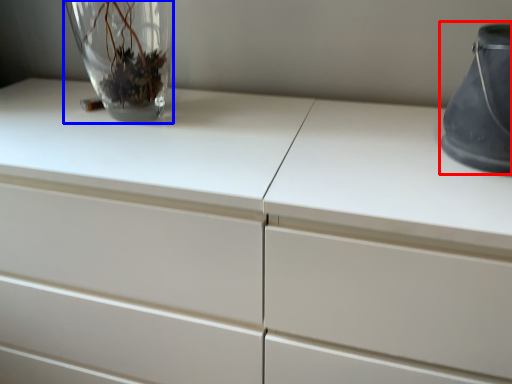
Question: Which of the following is the farthest to the observer, vase (highlighted by a red box) or vase (highlighted by a blue box)?

Choices:
 (A) vase
 (B) vase

Answer: (B)